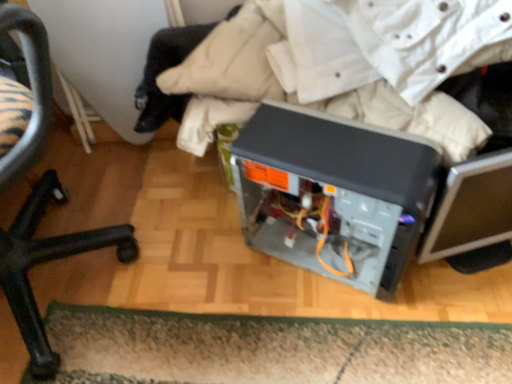
Identify the location of vacant space underneath green shaggy doormat at lower center (from a real-world perspective). This screenshot has height=384, width=512. (289, 352).